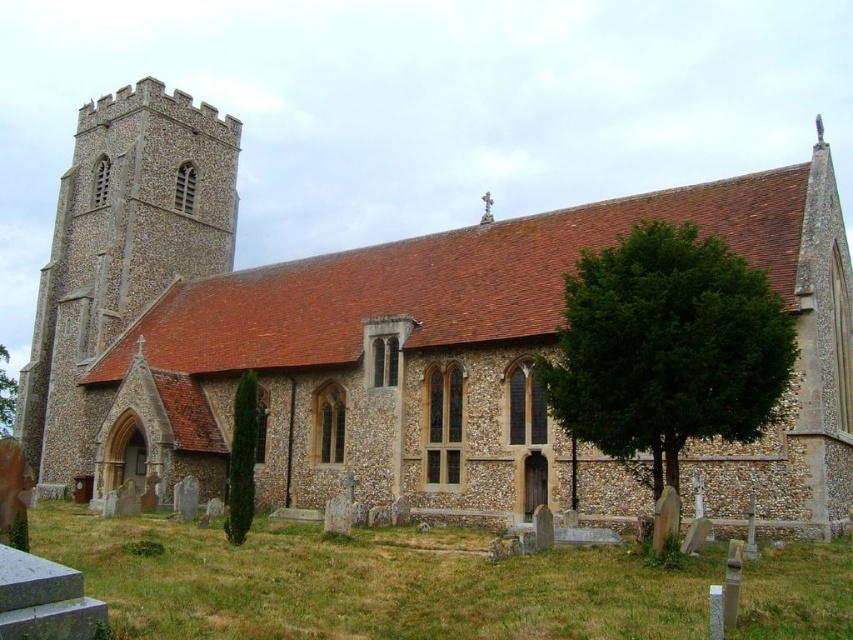
You are standing at the entrance of the church and want to walk towards the point labeled as point (612, 420). However, there is a point labeled point (6, 385) blocking your path. Will you be able to reach your destination without going around it?

Since point (612, 420) is in front of point (6, 385), you can reach point (612, 420) directly without needing to go around point (6, 385).

Looking at this image, you are standing at the entrance of the traditional stone church and notice a point marked at coordinates (241,460). Based on the scene description, what object is located at this coordinate?

The point at (241,460) corresponds to the green textured tree at lower left.